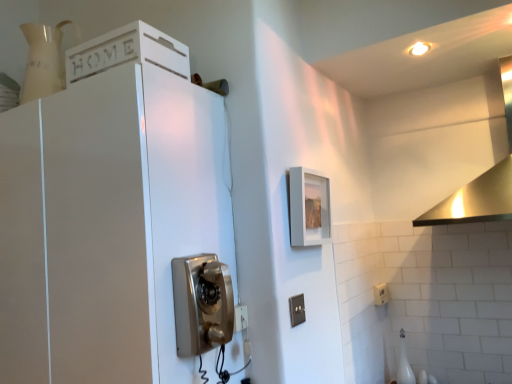
Question: Considering the relative sizes of black plastic switch at lower center, which is the second electric outlet from back to front, and stainless steel vent at upper right in the image provided, is black plastic switch at lower center, which is the second electric outlet from back to front, wider than stainless steel vent at upper right?

Choices:
 (A) no
 (B) yes

Answer: (A)

Question: Considering the relative sizes of black plastic switch at lower center, marked as the first electric outlet in a left-to-right arrangement, and stainless steel vent at upper right in the image provided, is black plastic switch at lower center, marked as the first electric outlet in a left-to-right arrangement, smaller than stainless steel vent at upper right?

Choices:
 (A) yes
 (B) no

Answer: (A)

Question: Can you confirm if black plastic switch at lower center, acting as the 1th electric outlet starting from the top, is thinner than stainless steel vent at upper right?

Choices:
 (A) no
 (B) yes

Answer: (B)

Question: Does black plastic switch at lower center, the second electric outlet viewed from the right, lie in front of stainless steel vent at upper right?

Choices:
 (A) yes
 (B) no

Answer: (B)

Question: Is there a large distance between black plastic switch at lower center, which is the first electric outlet in front-to-back order, and stainless steel vent at upper right?

Choices:
 (A) no
 (B) yes

Answer: (A)

Question: Considering the relative positions of matte gray picture frame at upper center and metallic silver phone at center in the image provided, is matte gray picture frame at upper center to the left or to the right of metallic silver phone at center?

Choices:
 (A) right
 (B) left

Answer: (A)

Question: Considering the positions of matte gray picture frame at upper center and metallic silver phone at center in the image, is matte gray picture frame at upper center taller or shorter than metallic silver phone at center?

Choices:
 (A) tall
 (B) short

Answer: (A)

Question: Considering the positions of matte gray picture frame at upper center and metallic silver phone at center in the image, is matte gray picture frame at upper center wider or thinner than metallic silver phone at center?

Choices:
 (A) thin
 (B) wide

Answer: (A)

Question: From the image's perspective, is matte gray picture frame at upper center positioned above or below metallic silver phone at center?

Choices:
 (A) above
 (B) below

Answer: (A)

Question: Considering their positions, is metallic silver phone at center located in front of or behind black plastic switch at lower center, the second electric outlet viewed from the right?

Choices:
 (A) behind
 (B) front

Answer: (B)

Question: Based on their sizes in the image, would you say metallic silver phone at center is bigger or smaller than black plastic switch at lower center, which is the second electric outlet in bottom-to-top order?

Choices:
 (A) small
 (B) big

Answer: (B)

Question: Considering the positions of metallic silver phone at center and black plastic switch at lower center, which is the second electric outlet in bottom-to-top order, in the image, is metallic silver phone at center taller or shorter than black plastic switch at lower center, which is the second electric outlet in bottom-to-top order,?

Choices:
 (A) tall
 (B) short

Answer: (A)

Question: Is metallic silver phone at center inside or outside of black plastic switch at lower center, the second electric outlet viewed from the right?

Choices:
 (A) outside
 (B) inside

Answer: (A)

Question: Relative to black plastic switch at lower center, marked as the first electric outlet in a left-to-right arrangement, is stainless steel vent at upper right in front or behind?

Choices:
 (A) behind
 (B) front

Answer: (B)

Question: Does point (504, 71) appear closer or farther from the camera than point (301, 297)?

Choices:
 (A) closer
 (B) farther

Answer: (B)